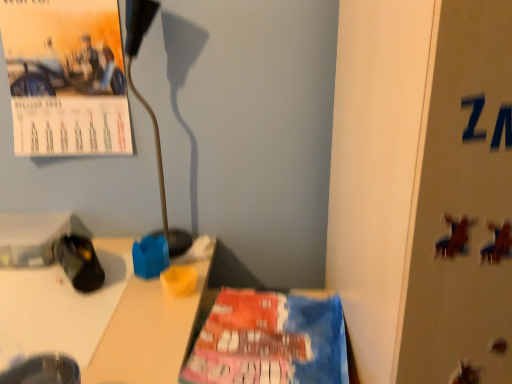
Question: From a real-world perspective, is metallic gold lamp at upper left physically located above or below metallic silver bulletin board at right?

Choices:
 (A) below
 (B) above

Answer: (B)

Question: Would you say metallic gold lamp at upper left is to the left or to the right of metallic silver bulletin board at right in the picture?

Choices:
 (A) right
 (B) left

Answer: (B)

Question: Estimate the real-world distances between objects in this image. Which object is farther from the matte paper calendar at upper left?

Choices:
 (A) black fabric shoe at lower left
 (B) metallic silver bulletin board at right
 (C) metallic gold lamp at upper left

Answer: (B)

Question: Which is farther from the black fabric shoe at lower left?

Choices:
 (A) metallic silver bulletin board at right
 (B) matte paper calendar at upper left
 (C) metallic gold lamp at upper left

Answer: (A)